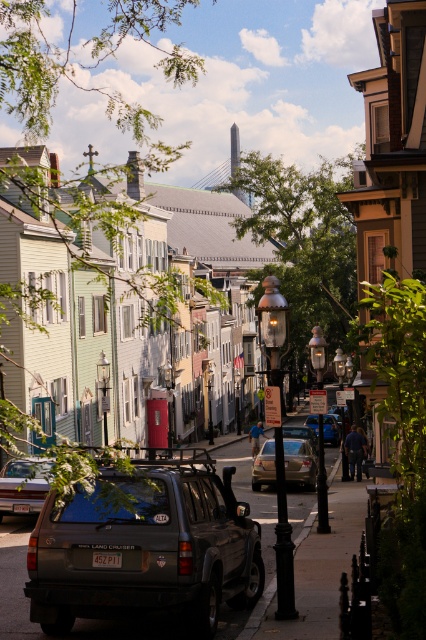
Is matte gray suv at center closer to the viewer compared to metallic silver sedan at center?

Yes, matte gray suv at center is in front of metallic silver sedan at center.

This screenshot has width=426, height=640. Identify the location of matte gray suv at center. (146, 547).

Does matte gray suv at center appear on the right side of matte gray suv at lower left?

Yes, matte gray suv at center is to the right of matte gray suv at lower left.

Can you confirm if matte gray suv at center is positioned above matte gray suv at lower left?

Incorrect, matte gray suv at center is not positioned above matte gray suv at lower left.

Which is in front, point (120, 476) or point (31, 477)?

Point (120, 476) is in front.

The image size is (426, 640). In order to click on matte gray suv at center in this screenshot , I will do `click(146, 547)`.

I want to click on metallic silver sedan at center, so click(x=331, y=429).

Does metallic silver sedan at center have a greater width compared to metallic silver suv at center?

Correct, the width of metallic silver sedan at center exceeds that of metallic silver suv at center.

Which is behind, point (328, 413) or point (293, 433)?

The point (328, 413) is behind.

Locate an element on the screen. Image resolution: width=426 pixels, height=640 pixels. metallic silver sedan at center is located at coordinates (331, 429).